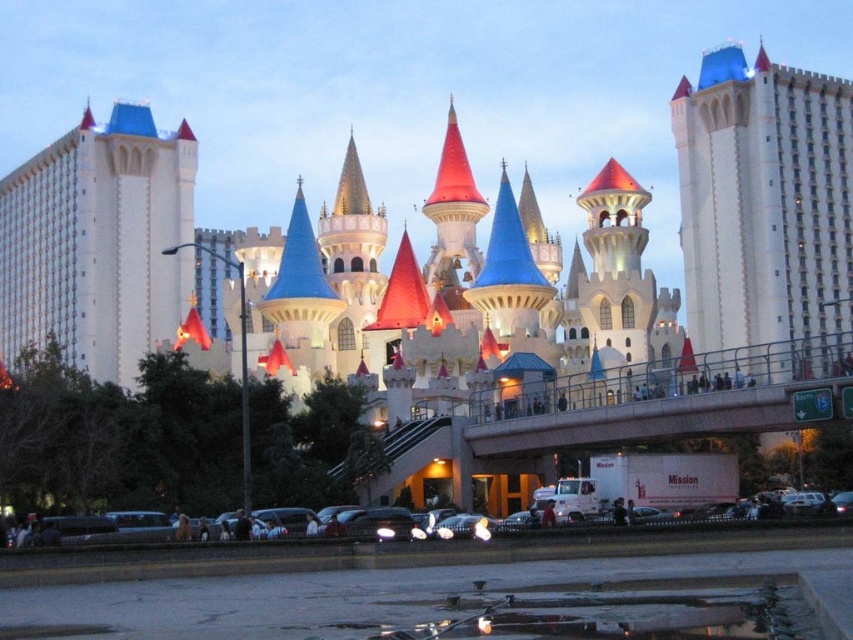
You are standing at the point marked as point (764, 205). Which direction should you walk to reach the white stone castle at right?

The white stone castle at right is represented by point (764, 205), so you are already at the white stone castle at right.

You are a tour guide explaining the distance between the white glossy hotel tower at left and the shiny black car at lower center to a tourist. What would you say?

The white glossy hotel tower at left and the shiny black car at lower center are 187.08 feet apart from each other.